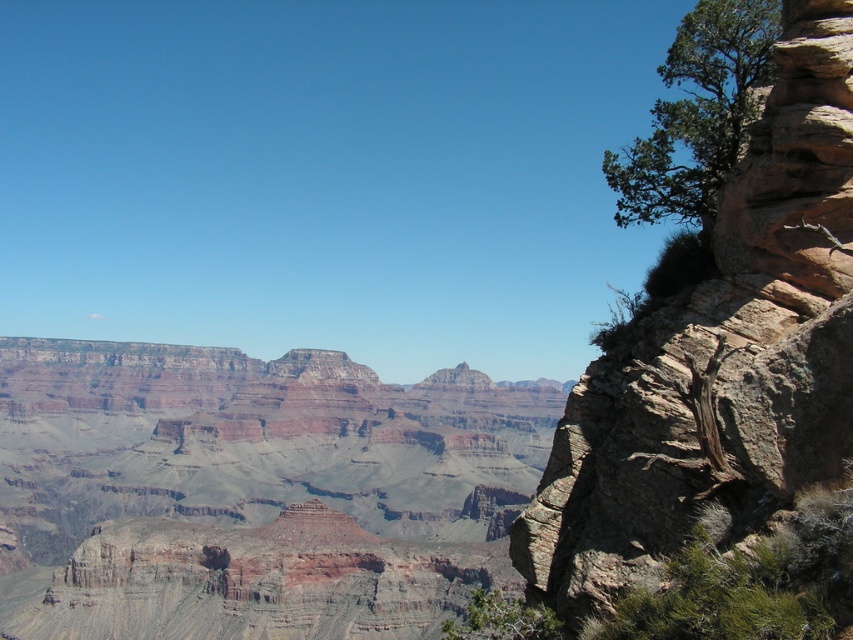
You are a hiker standing at the edge of the canyon and want to take a photo of both the rustic brown cliff at right and the green leafy tree at lower right. Which object should you frame first in your camera to ensure both fit in the photo?

You should frame the rustic brown cliff at right first because its width surpasses that of the green leafy tree at lower right, so ensuring the wider object is centered will help both fit better in the photo.

You are standing at the center of the canyon looking towards the cliff face. Which direction should you look to see the green leafy tree at upper right?

The green leafy tree at upper right is located at point coordinates of [697,113], which is in the upper right direction from your current position at the center of the canyon.

You are standing at the edge of the canyon and want to determine which of the two points, point (238, 429) or point (618, 205), is closer to you. Based on the image, which point is nearer?

Point (238, 429) is closer to you because it is further to the viewer than point (618, 205).